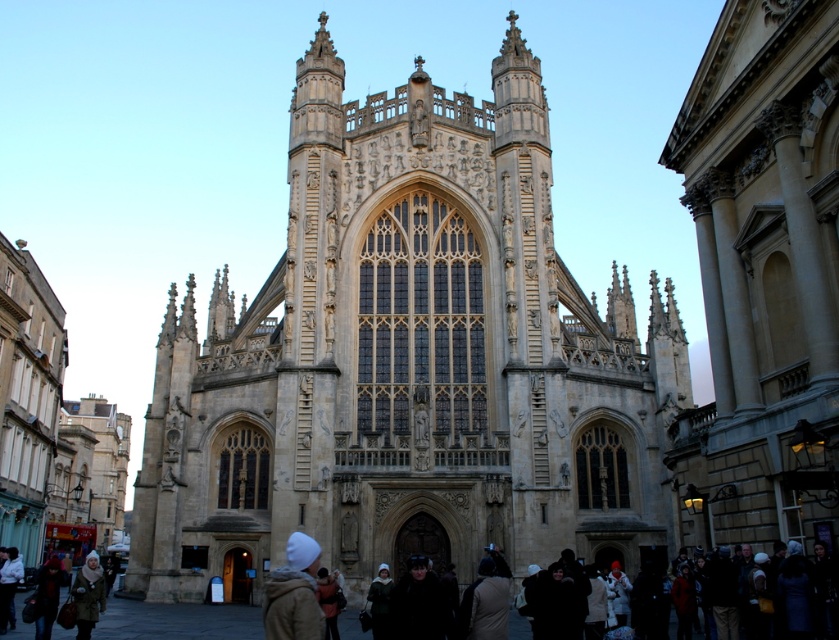
You are standing in front of the beige stone church at center and want to take a photo of the fluffy white hat at lower left. Will the hat be visible in the photo if you don

The fluffy white hat at lower left is behind the beige stone church at center, so it will not be visible in the photo.

You are a photographer standing in front of the cathedral and notice two items at the lower left corner of your viewfinder. You want to ensure both the fluffy white hat at lower left and the light brown leather jacket at lower left are clearly visible in the photo. Given their sizes, which item might you need to adjust your focus on to capture both details?

The fluffy white hat at lower left is larger in size than the light brown leather jacket at lower left, so you should focus on capturing the details of the fluffy white hat at lower left first to ensure it doesn not overpower the smaller jacket in the frame.